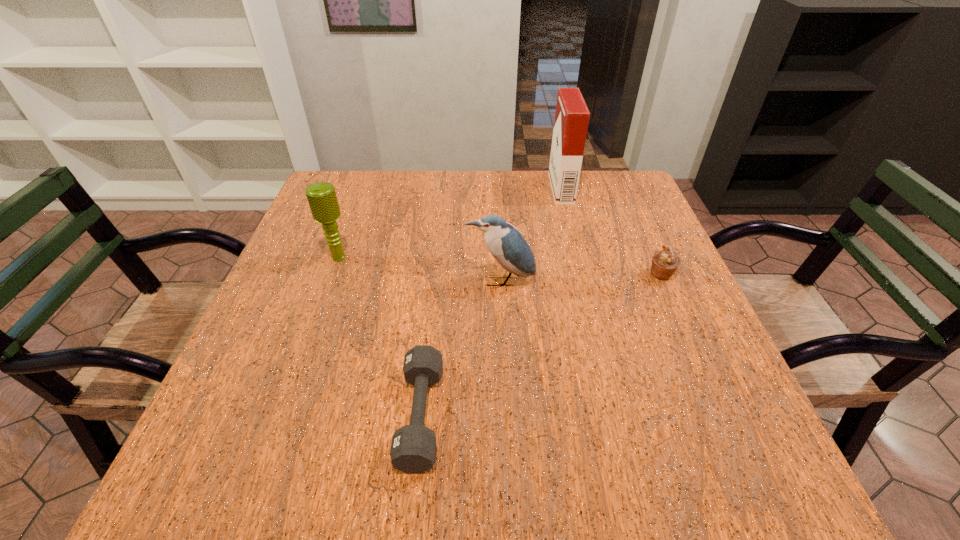
The width and height of the screenshot is (960, 540). I want to click on vacant space situated 0.060m on the front-facing side of the farthest object, so click(x=531, y=188).

Where is `vacant space situated 0.250m on the front-facing side of the farthest object`? vacant space situated 0.250m on the front-facing side of the farthest object is located at coordinates (464, 188).

Image resolution: width=960 pixels, height=540 pixels. In order to click on vacant space located on the back of the second farthest object in this screenshot , I will do `click(349, 229)`.

In order to click on vacant space situated 0.300m at the tip of the bird's beak in this screenshot , I will do `click(507, 418)`.

At what (x,y) coordinates should I click in order to perform the action: click on free space located 0.160m on the front of the fourth tallest object. Please return your answer as a coordinate pair (x, y). The height and width of the screenshot is (540, 960). Looking at the image, I should click on (690, 341).

The width and height of the screenshot is (960, 540). I want to click on vacant region located on the right of the dumbbell, so click(x=554, y=415).

Find the location of a particular element. object located at the far edge is located at coordinates (572, 116).

Find the location of a particular element. The width and height of the screenshot is (960, 540). object that is at the near edge is located at coordinates (413, 448).

Find the location of `object that is at the left edge`. object that is at the left edge is located at coordinates (322, 199).

This screenshot has height=540, width=960. Identify the location of object at the right edge. (665, 262).